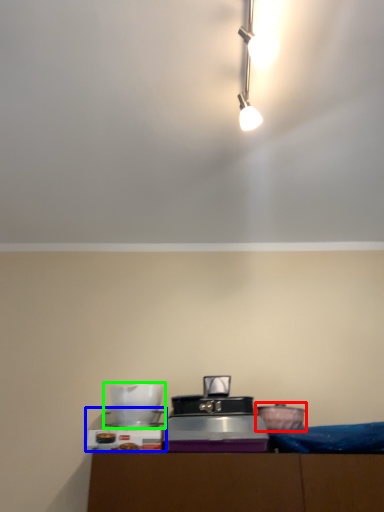
Question: Based on their relative distances, which object is farther from appliance (highlighted by a red box)? Choose from appliance (highlighted by a blue box) and appliance (highlighted by a green box).

Choices:
 (A) appliance
 (B) appliance

Answer: (A)